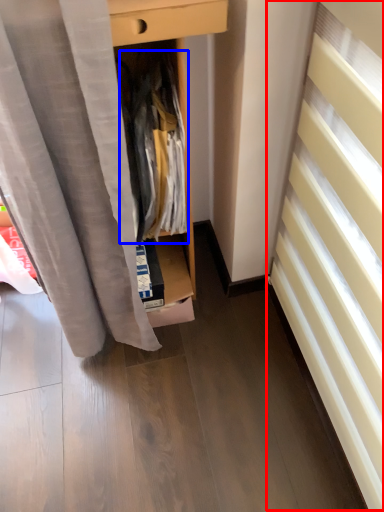
Question: Which object is further to the camera taking this photo, stairwell (highlighted by a red box) or clothing (highlighted by a blue box)?

Choices:
 (A) stairwell
 (B) clothing

Answer: (B)